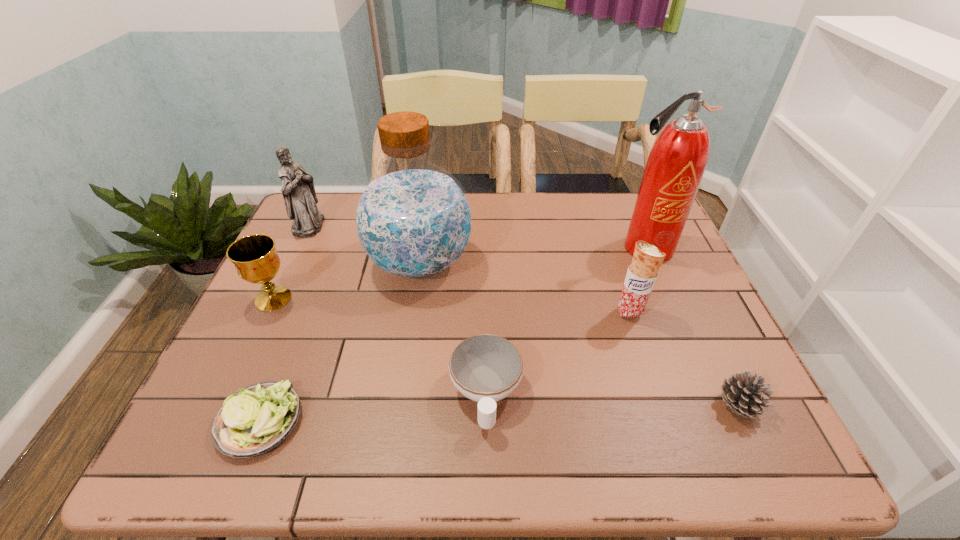
Identify the location of free space between the water jug and the pinecone. (579, 334).

You are a GUI agent. You are given a task and a screenshot of the screen. Output one action in this format:
    pyautogui.click(x=<x>, y=<y>)
    Task: Click on the free space between the chinaware and the shortest object
    The width and height of the screenshot is (960, 540).
    Given the screenshot: What is the action you would take?
    pyautogui.click(x=372, y=407)

This screenshot has height=540, width=960. What are the coordinates of `unoccupied area between the lettuce and the sixth shortest object` in the screenshot? It's located at (284, 323).

Select which object is the third closest to the fifth tallest object. Please provide its 2D coordinates. Your answer should be formatted as a tuple, i.e. [(x, y)], where the tuple contains the x and y coordinates of a point satisfying the conditions above.

[(258, 418)]

Choose which object is the fourth nearest neighbor to the pinecone. Please provide its 2D coordinates. Your answer should be formatted as a tuple, i.e. [(x, y)], where the tuple contains the x and y coordinates of a point satisfying the conditions above.

[(413, 220)]

Image resolution: width=960 pixels, height=540 pixels. Find the location of `vacant point that satisfies the following two spatial constraints: 1. on the front side of the fifth tallest object; 2. on the left side of the pinecone`. vacant point that satisfies the following two spatial constraints: 1. on the front side of the fifth tallest object; 2. on the left side of the pinecone is located at coordinates (223, 405).

The width and height of the screenshot is (960, 540). I want to click on vacant region that satisfies the following two spatial constraints: 1. on the front side of the fourth tallest object; 2. on the left side of the chalice, so click(267, 313).

Locate an element on the screen. This screenshot has height=540, width=960. free space in the image that satisfies the following two spatial constraints: 1. on the front-facing side of the pinecone; 2. on the right side of the third tallest object is located at coordinates (224, 405).

Where is `vacant position in the image that satisfies the following two spatial constraints: 1. on the front-facing side of the lettuce; 2. on the left side of the figurine`? The height and width of the screenshot is (540, 960). vacant position in the image that satisfies the following two spatial constraints: 1. on the front-facing side of the lettuce; 2. on the left side of the figurine is located at coordinates (216, 421).